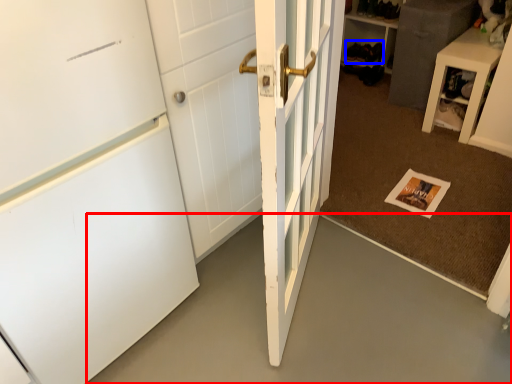
Question: Which object is further to the camera taking this photo, concrete (highlighted by a red box) or shoe (highlighted by a blue box)?

Choices:
 (A) concrete
 (B) shoe

Answer: (B)